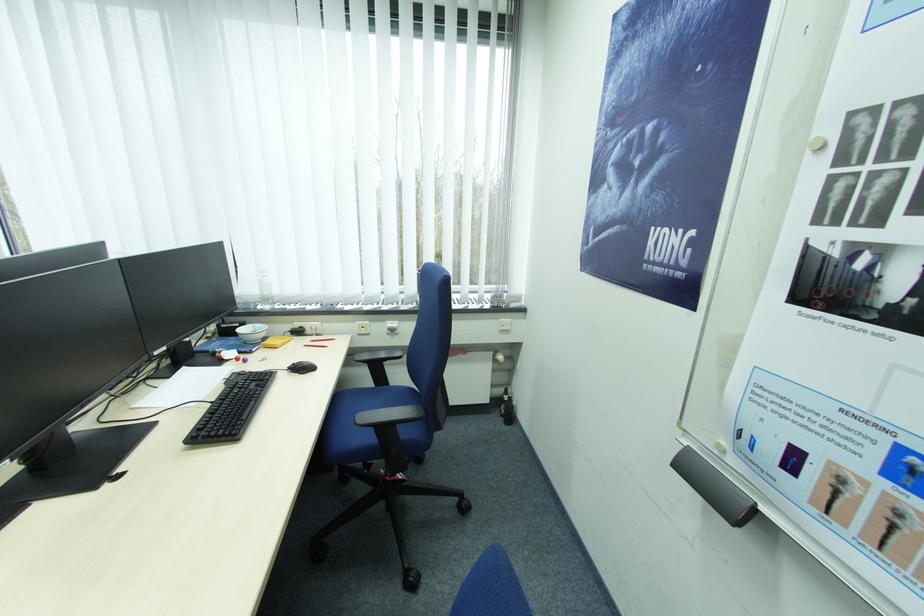
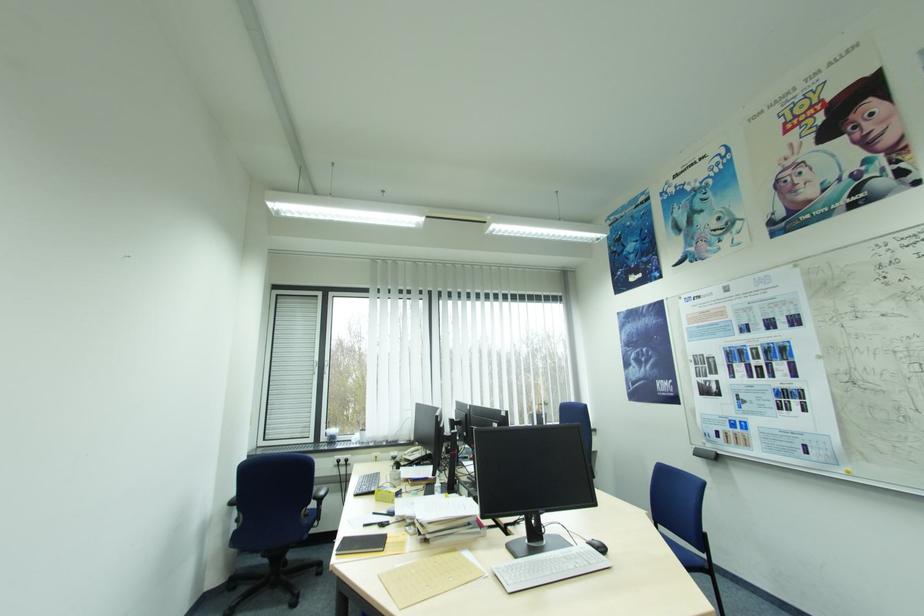
The images are taken continuously from a first-person perspective. In which direction are you moving?

The cameraman walked toward left, backward.